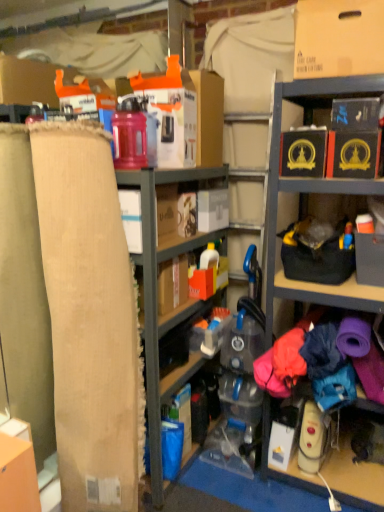
Question: Is burlap cardboard at left a part of black cardboard box at upper right, the 3th storage box in the left-to-right sequence?

Choices:
 (A) no
 (B) yes

Answer: (A)

Question: Is black cardboard box at upper right, acting as the 1th storage box starting from the right, not close to burlap cardboard at left?

Choices:
 (A) no
 (B) yes

Answer: (B)

Question: Is black cardboard box at upper right, the 3th storage box in the left-to-right sequence, outside burlap cardboard at left?

Choices:
 (A) yes
 (B) no

Answer: (A)

Question: Is black cardboard box at upper right, acting as the 1th storage box starting from the right, oriented towards burlap cardboard at left?

Choices:
 (A) yes
 (B) no

Answer: (B)

Question: Is black cardboard box at upper right, acting as the 1th storage box starting from the right, thinner than burlap cardboard at left?

Choices:
 (A) no
 (B) yes

Answer: (A)

Question: Does black cardboard box at upper right, acting as the 1th storage box starting from the right, appear on the right side of burlap cardboard at left?

Choices:
 (A) no
 (B) yes

Answer: (B)

Question: Does matte cardboard box at upper right have a greater height compared to black cardboard box at upper right, the 3th storage box in the left-to-right sequence?

Choices:
 (A) no
 (B) yes

Answer: (B)

Question: Considering the relative sizes of matte cardboard box at upper right and black cardboard box at upper right, acting as the 1th storage box starting from the right, in the image provided, is matte cardboard box at upper right thinner than black cardboard box at upper right, acting as the 1th storage box starting from the right,?

Choices:
 (A) no
 (B) yes

Answer: (B)

Question: Is matte cardboard box at upper right located outside black cardboard box at upper right, acting as the 1th storage box starting from the right?

Choices:
 (A) no
 (B) yes

Answer: (B)

Question: From a real-world perspective, is matte cardboard box at upper right over black cardboard box at upper right, acting as the 1th storage box starting from the right?

Choices:
 (A) no
 (B) yes

Answer: (B)

Question: Is the surface of matte cardboard box at upper right in direct contact with black cardboard box at upper right, the 3th storage box in the left-to-right sequence?

Choices:
 (A) no
 (B) yes

Answer: (A)

Question: Is matte cardboard box at upper right smaller than black cardboard box at upper right, acting as the 1th storage box starting from the right?

Choices:
 (A) no
 (B) yes

Answer: (A)

Question: Can you confirm if burlap cardboard at left is thinner than beige fabric at left?

Choices:
 (A) no
 (B) yes

Answer: (A)